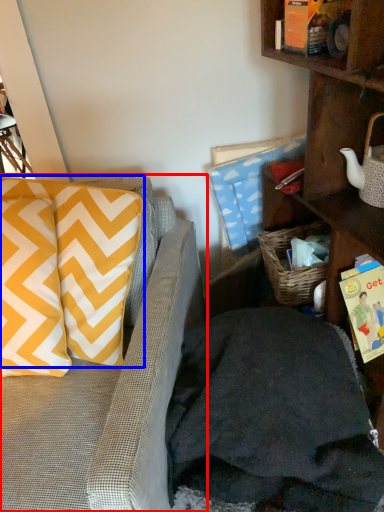
Question: Among these objects, which one is farthest to the camera, studio couch (highlighted by a red box) or pillow (highlighted by a blue box)?

Choices:
 (A) studio couch
 (B) pillow

Answer: (B)